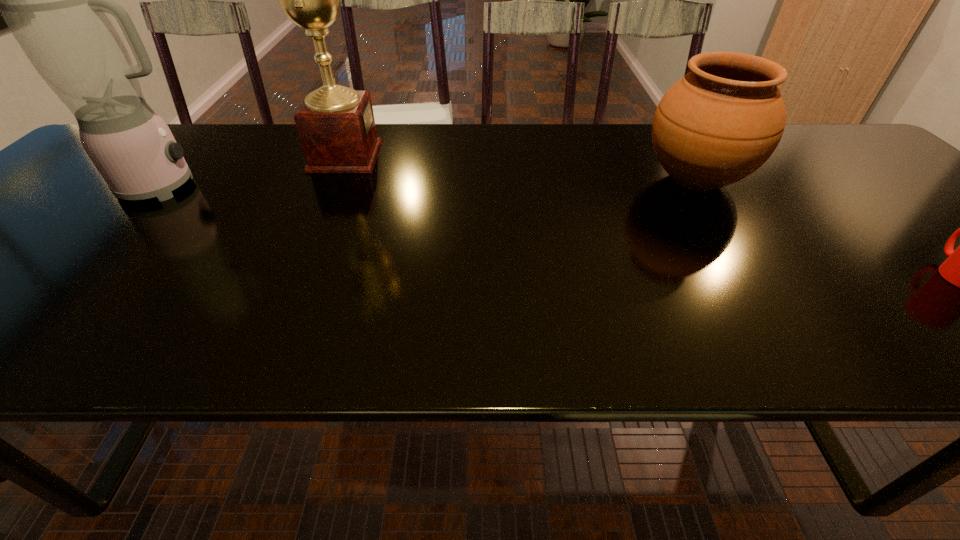
The height and width of the screenshot is (540, 960). Identify the location of the closest object to the pottery. (959, 269).

Locate which object ranks third in proximity to the rightmost object. Please provide its 2D coordinates. Your answer should be formatted as a tuple, i.e. [(x, y)], where the tuple contains the x and y coordinates of a point satisfying the conditions above.

[(56, 0)]